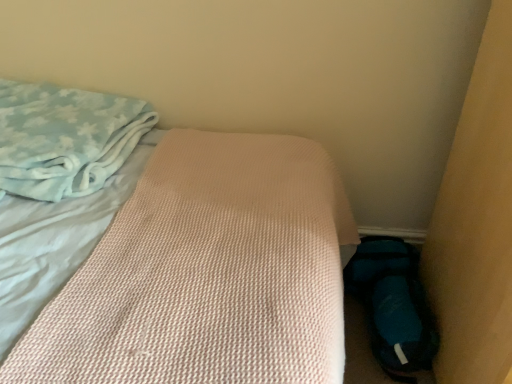
Question: Does pink textured mattress at center have a smaller size compared to light blue plush blanket at upper left?

Choices:
 (A) yes
 (B) no

Answer: (B)

Question: Is light blue plush blanket at upper left at the back of pink textured mattress at center?

Choices:
 (A) no
 (B) yes

Answer: (B)

Question: Considering the relative sizes of pink textured mattress at center and light blue plush blanket at upper left in the image provided, is pink textured mattress at center thinner than light blue plush blanket at upper left?

Choices:
 (A) yes
 (B) no

Answer: (B)

Question: Does pink textured mattress at center lie in front of light blue plush blanket at upper left?

Choices:
 (A) no
 (B) yes

Answer: (B)

Question: Is pink textured mattress at center shorter than light blue plush blanket at upper left?

Choices:
 (A) no
 (B) yes

Answer: (A)

Question: Considering the relative positions of pink textured mattress at center and light blue plush blanket at upper left in the image provided, is pink textured mattress at center to the left of light blue plush blanket at upper left from the viewer's perspective?

Choices:
 (A) yes
 (B) no

Answer: (B)

Question: From the image's perspective, is blue fabric shoe at lower right above light blue plush blanket at upper left?

Choices:
 (A) yes
 (B) no

Answer: (B)

Question: Is blue fabric shoe at lower right not inside light blue plush blanket at upper left?

Choices:
 (A) yes
 (B) no

Answer: (A)

Question: Does blue fabric shoe at lower right have a smaller size compared to light blue plush blanket at upper left?

Choices:
 (A) yes
 (B) no

Answer: (A)

Question: Can you see blue fabric shoe at lower right touching light blue plush blanket at upper left?

Choices:
 (A) yes
 (B) no

Answer: (B)

Question: Would you say blue fabric shoe at lower right contains light blue plush blanket at upper left?

Choices:
 (A) no
 (B) yes

Answer: (A)

Question: Does blue fabric shoe at lower right have a greater width compared to light blue plush blanket at upper left?

Choices:
 (A) yes
 (B) no

Answer: (B)

Question: From a real-world perspective, is light blue plush blanket at upper left positioned under pink textured mattress at center based on gravity?

Choices:
 (A) no
 (B) yes

Answer: (A)